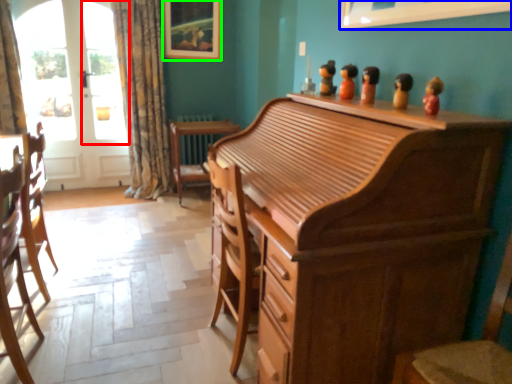
Question: Which object is the farthest from window screen (highlighted by a red box)? Choose among these: picture frame (highlighted by a blue box) or picture frame (highlighted by a green box).

Choices:
 (A) picture frame
 (B) picture frame

Answer: (A)